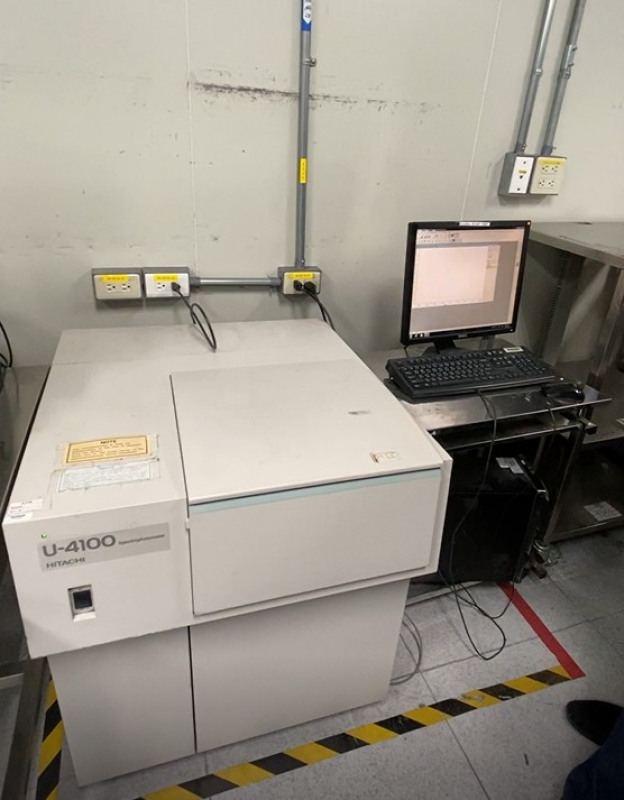
Find the location of a particular element. This screenshot has height=800, width=624. table is located at coordinates (517, 406).